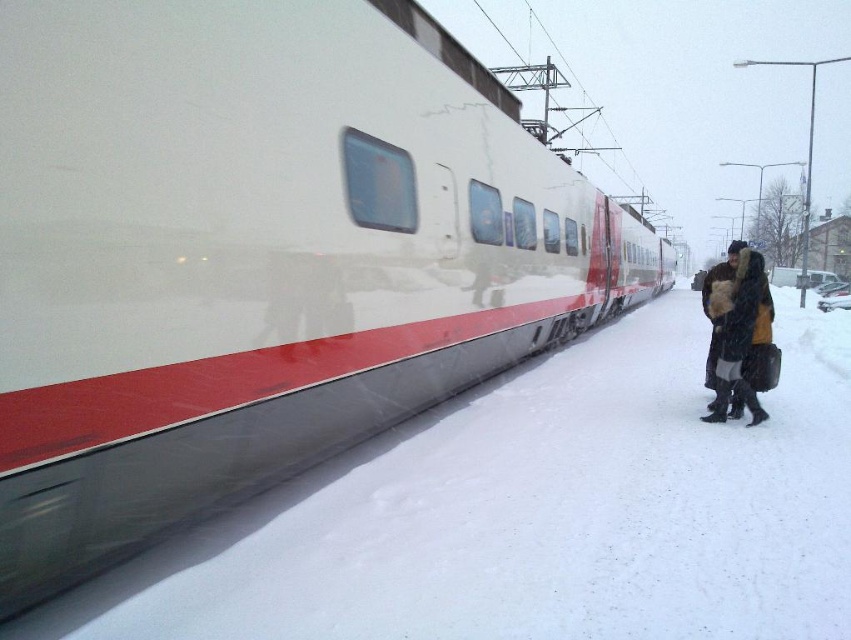
Question: Is white powdery snow at lower left above dark brown fur-trimmed coat at right?

Choices:
 (A) no
 (B) yes

Answer: (A)

Question: Does white powdery snow at lower left appear on the left side of dark brown fur-trimmed coat at right?

Choices:
 (A) yes
 (B) no

Answer: (A)

Question: Which point is closer to the camera?

Choices:
 (A) (718, 317)
 (B) (655, 372)

Answer: (A)

Question: Which point is farther from the camera taking this photo?

Choices:
 (A) (758, 273)
 (B) (804, 596)

Answer: (A)

Question: Can you confirm if white powdery snow at lower left is smaller than dark brown fur-trimmed coat at right?

Choices:
 (A) no
 (B) yes

Answer: (A)

Question: Which of the following is the farthest from the observer?

Choices:
 (A) white powdery snow at lower left
 (B) dark brown fur-trimmed coat at right

Answer: (B)